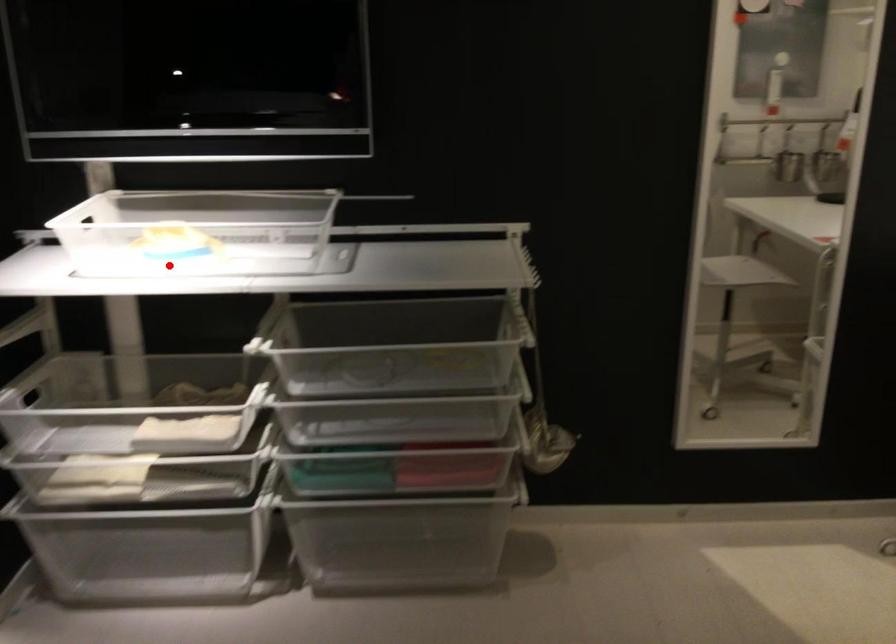
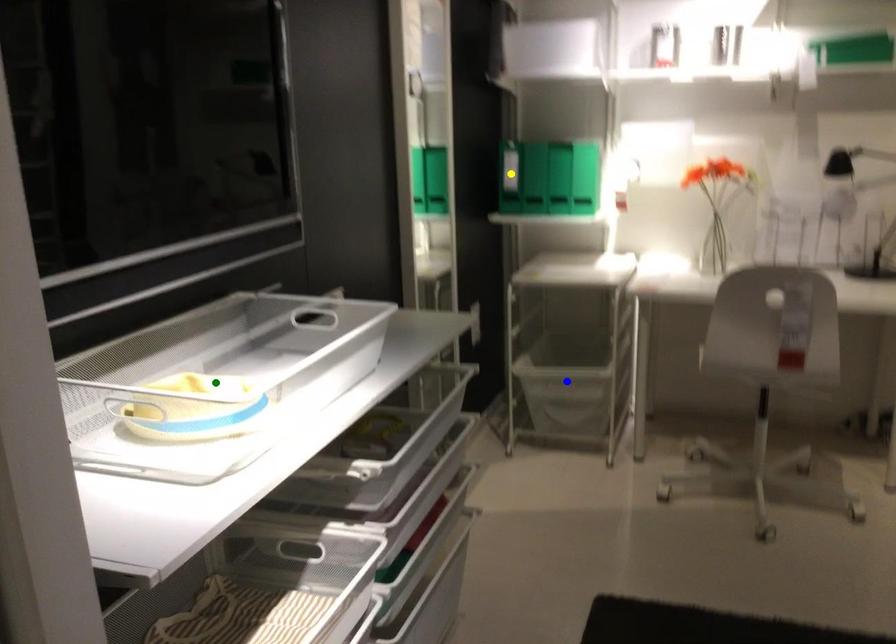
Question: I am providing you with two images of the same scene from different viewpoints. A red point is marked on the first image. You are given multiple points on the second image. Which point in image 2 represents the same 3d spot as the red point in image 1?

Choices:
 (A) green point
 (B) blue point
 (C) yellow point

Answer: (A)